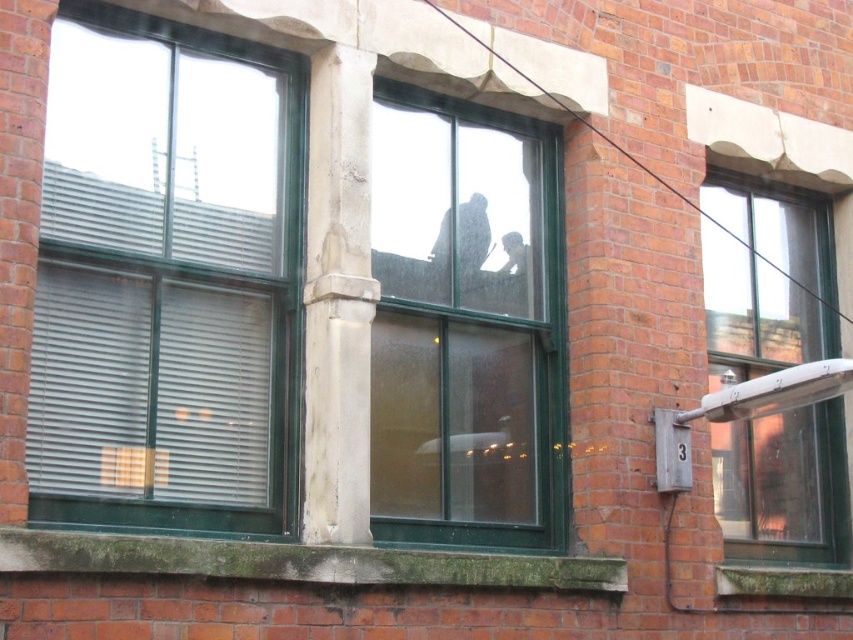
You are an architect designing a new building and want to ensure that the green glass window at center and the clear glass window at right provide adequate natural light. Given their sizes, which window will allow more sunlight into the building?

The green glass window at center will allow more sunlight into the building because it is larger in size than the clear glass window at right.

You are standing outside the brick building and want to look through the windows to see the workbench inside. Which window should you look through to get a better view of the workbench? The green glass window at left or the clear glass window at right?

You should look through the clear glass window at right because it is not obstructed by blinds like the green glass window at left, allowing for a clearer view of the workbench inside.